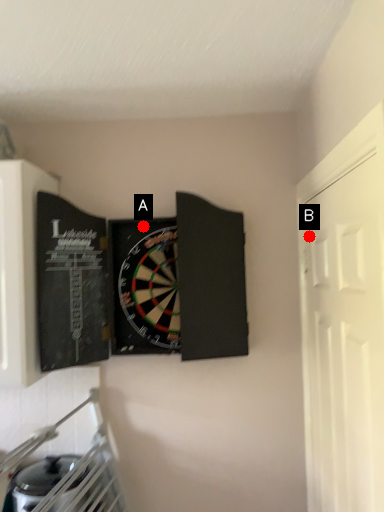
Question: Two points are circled on the image, labeled by A and B beside each circle. Which point is farther to the camera?

Choices:
 (A) A is further
 (B) B is further

Answer: (A)